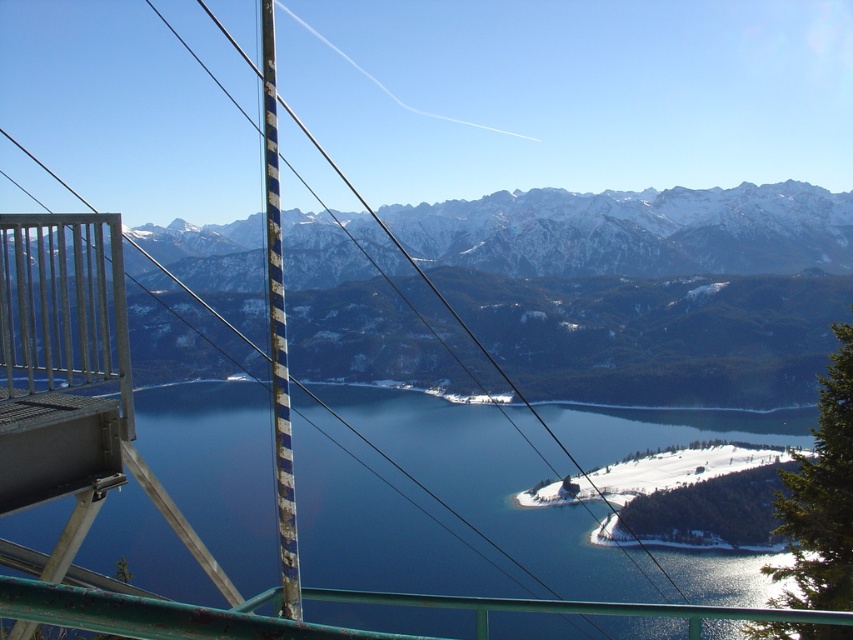
Question: Is blue glassy water at center to the left of white snow ski slope at lower right from the viewer's perspective?

Choices:
 (A) no
 (B) yes

Answer: (B)

Question: Estimate the real-world distances between objects in this image. Which object is farther from the blue glassy water at center?

Choices:
 (A) white snow ski slope at lower right
 (B) snowy mountain range at upper center

Answer: (B)

Question: Which of these objects is positioned closest to the blue glassy water at center?

Choices:
 (A) white snow ski slope at lower right
 (B) snowy mountain range at upper center

Answer: (A)

Question: Does blue glassy water at center have a larger size compared to white snow ski slope at lower right?

Choices:
 (A) yes
 (B) no

Answer: (A)

Question: Among these points, which one is nearest to the camera?

Choices:
 (A) (517, 282)
 (B) (207, 516)

Answer: (B)

Question: Where is snowy mountain range at upper center located in relation to white snow ski slope at lower right in the image?

Choices:
 (A) left
 (B) right

Answer: (A)